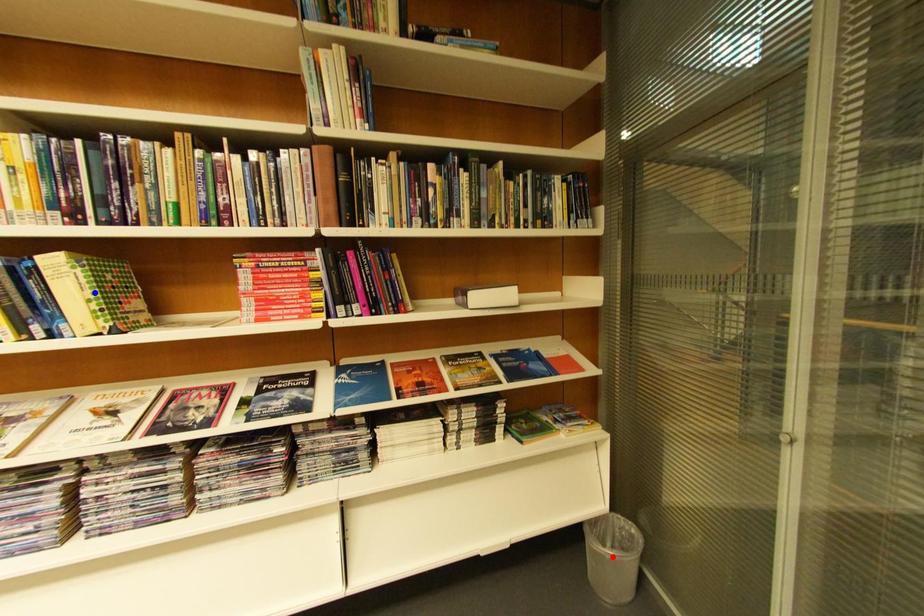
Question: Two points are marked on the image. Which point is closer to the camera?

Choices:
 (A) Blue point is closer.
 (B) Red point is closer.

Answer: (A)